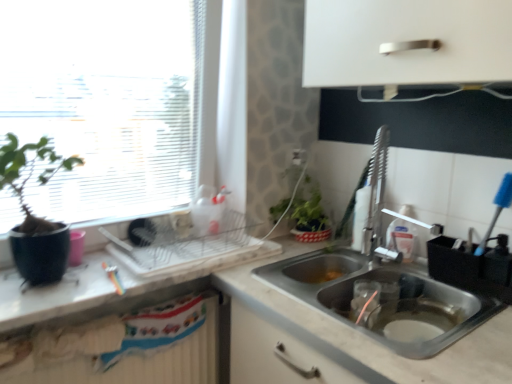
Question: Is transparent glass window at upper left further to the viewer compared to metallic dish rack at center, acting as the first appliance starting from the left?

Choices:
 (A) no
 (B) yes

Answer: (A)

Question: Is transparent glass window at upper left taller than metallic dish rack at center, acting as the first appliance starting from the left?

Choices:
 (A) no
 (B) yes

Answer: (B)

Question: Can you confirm if transparent glass window at upper left is positioned to the left of metallic dish rack at center, acting as the first appliance starting from the left?

Choices:
 (A) yes
 (B) no

Answer: (A)

Question: From the image's perspective, is transparent glass window at upper left under metallic dish rack at center, the second appliance positioned from the right?

Choices:
 (A) yes
 (B) no

Answer: (B)

Question: From the image's perspective, is transparent glass window at upper left located above metallic dish rack at center, the second appliance positioned from the right?

Choices:
 (A) yes
 (B) no

Answer: (A)

Question: Does transparent glass window at upper left have a larger size compared to metallic dish rack at center, the second appliance positioned from the right?

Choices:
 (A) no
 (B) yes

Answer: (B)

Question: Are black plastic utensil holder at sink, the first appliance viewed from the right, and stainless steel sink at lower right, the first sink ordered from the bottom, far apart?

Choices:
 (A) yes
 (B) no

Answer: (B)

Question: Is black plastic utensil holder at sink, acting as the 2th appliance starting from the left, surrounding stainless steel sink at lower right, the first sink ordered from the bottom?

Choices:
 (A) yes
 (B) no

Answer: (B)

Question: Does black plastic utensil holder at sink, the first appliance viewed from the right, appear on the left side of stainless steel sink at lower right, acting as the second sink starting from the top?

Choices:
 (A) no
 (B) yes

Answer: (A)

Question: Considering the relative sizes of black plastic utensil holder at sink, acting as the 2th appliance starting from the left, and stainless steel sink at lower right, acting as the second sink starting from the top, in the image provided, is black plastic utensil holder at sink, acting as the 2th appliance starting from the left, smaller than stainless steel sink at lower right, acting as the second sink starting from the top,?

Choices:
 (A) yes
 (B) no

Answer: (A)

Question: Can you confirm if black plastic utensil holder at sink, acting as the 2th appliance starting from the left, is bigger than stainless steel sink at lower right, acting as the second sink starting from the top?

Choices:
 (A) no
 (B) yes

Answer: (A)

Question: Considering the relative sizes of black plastic utensil holder at sink, the first appliance viewed from the right, and stainless steel sink at lower right, the first sink ordered from the bottom, in the image provided, is black plastic utensil holder at sink, the first appliance viewed from the right, thinner than stainless steel sink at lower right, the first sink ordered from the bottom,?

Choices:
 (A) no
 (B) yes

Answer: (B)

Question: Is white marble countertop at lower right, which appears as the second countertop when viewed from the top, oriented away from matte black pot at left?

Choices:
 (A) no
 (B) yes

Answer: (A)